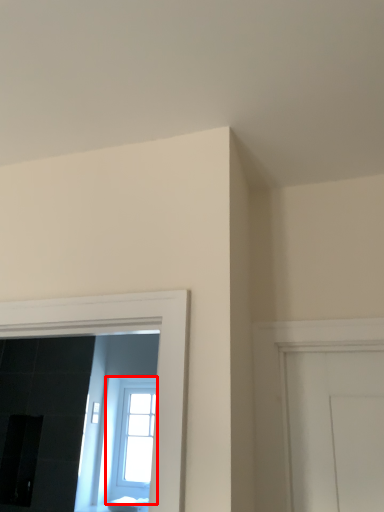
Question: From the image's perspective, where is window (annotated by the red box) located in relation to furniture in the image?

Choices:
 (A) below
 (B) above

Answer: (B)